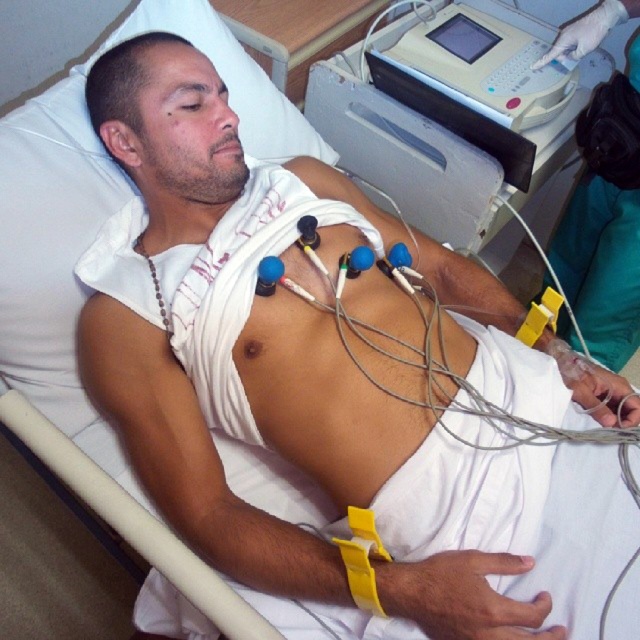
In the medical scene, there are two machines at the upper right corner of the image. Which one is positioned to the left when looking at the gray plastic machine at upper right and the white plastic machine at upper right?

The gray plastic machine at upper right is positioned to the left of the white plastic machine at upper right.

You are a nurse in the hospital room and need to place a new medical device between the gray plastic machine at upper right and the white plastic machine at upper right. Can you fit it if the device requires 1 meter of space?

The gray plastic machine at upper right is wider than the white plastic machine at upper right, but the exact distance between them isn

You are a nurse in a hospital room and need to determine which machine is taller between the gray plastic machine at upper right and the white plastic machine at upper right. Based on the scene description, which machine should you choose?

The gray plastic machine at upper right is much taller than the white plastic machine at upper right, so you should choose the gray plastic machine at upper right.